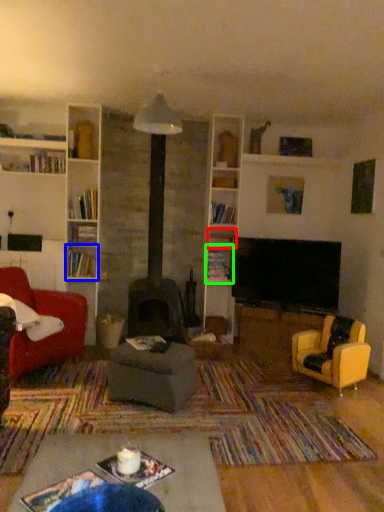
Question: Which object is positioned closest to shelf (highlighted by a red box)? Select from shelf (highlighted by a blue box) and shelf (highlighted by a green box).

Choices:
 (A) shelf
 (B) shelf

Answer: (B)